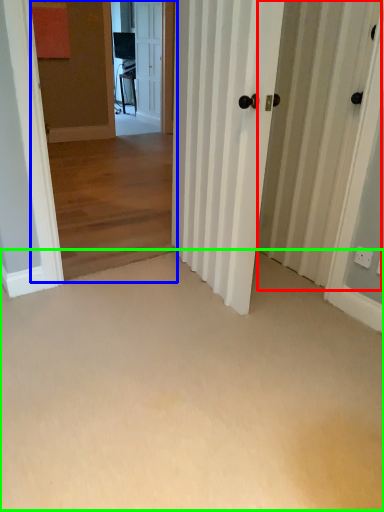
Question: Based on their relative distances, which object is farther from barn door (highlighted by a red box)? Choose from corridor (highlighted by a blue box) and corridor (highlighted by a green box).

Choices:
 (A) corridor
 (B) corridor

Answer: (A)